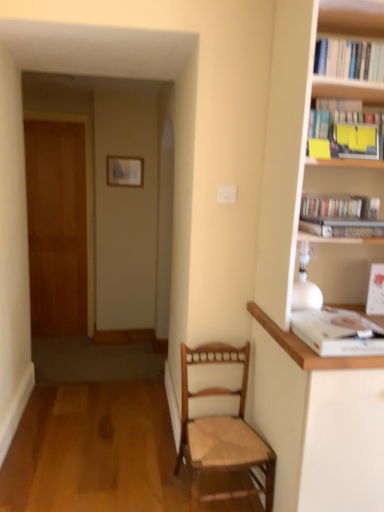
Question: Considering the relative positions of yellow paper at upper right, acting as the 2th book starting from the top, and white paper book at upper right, the fifth book positioned from the top, in the image provided, is yellow paper at upper right, acting as the 2th book starting from the top, to the right of white paper book at upper right, the fifth book positioned from the top, from the viewer's perspective?

Choices:
 (A) yes
 (B) no

Answer: (A)

Question: From the image's perspective, is yellow paper at upper right, acting as the 2th book starting from the top, over white paper book at upper right, which is counted as the first book, starting from the bottom?

Choices:
 (A) yes
 (B) no

Answer: (A)

Question: Is yellow paper at upper right, which appears as the fourth book when ordered from the bottom, wider than white paper book at upper right, which is counted as the first book, starting from the bottom?

Choices:
 (A) no
 (B) yes

Answer: (A)

Question: Considering the relative positions of yellow paper at upper right, which appears as the fourth book when ordered from the bottom, and white paper book at upper right, which is counted as the first book, starting from the bottom, in the image provided, is yellow paper at upper right, which appears as the fourth book when ordered from the bottom, to the left of white paper book at upper right, which is counted as the first book, starting from the bottom, from the viewer's perspective?

Choices:
 (A) yes
 (B) no

Answer: (B)

Question: Is yellow paper at upper right, which appears as the fourth book when ordered from the bottom, not close to white paper book at upper right, which is counted as the first book, starting from the bottom?

Choices:
 (A) no
 (B) yes

Answer: (A)

Question: Do you think wooden picture frame at upper center is within hardcover book at upper right, the 2th book in the bottom-to-top sequence, or outside of it?

Choices:
 (A) inside
 (B) outside

Answer: (B)

Question: From a real-world perspective, is wooden picture frame at upper center physically located above or below hardcover book at upper right, marked as the 4th book in a top-to-bottom arrangement?

Choices:
 (A) below
 (B) above

Answer: (B)

Question: Would you say wooden picture frame at upper center is to the left or to the right of hardcover book at upper right, marked as the 4th book in a top-to-bottom arrangement, in the picture?

Choices:
 (A) left
 (B) right

Answer: (A)

Question: In terms of width, does wooden picture frame at upper center look wider or thinner when compared to hardcover book at upper right, the 2th book in the bottom-to-top sequence?

Choices:
 (A) thin
 (B) wide

Answer: (A)

Question: Visually, is wooden door at left positioned to the left or to the right of white paperbacks at upper right, the 5th book ordered from the bottom?

Choices:
 (A) right
 (B) left

Answer: (B)

Question: Is wooden door at left wider or thinner than white paperbacks at upper right, arranged as the first book when viewed from the top?

Choices:
 (A) wide
 (B) thin

Answer: (B)

Question: Do you think wooden door at left is within white paperbacks at upper right, arranged as the first book when viewed from the top, or outside of it?

Choices:
 (A) outside
 (B) inside

Answer: (A)

Question: Considering the positions of wooden door at left and white paperbacks at upper right, the 5th book ordered from the bottom, in the image, is wooden door at left bigger or smaller than white paperbacks at upper right, the 5th book ordered from the bottom,?

Choices:
 (A) small
 (B) big

Answer: (B)

Question: Is wooden desk at right to the left or to the right of hardcover book at upper right, the 2th book in the bottom-to-top sequence, in the image?

Choices:
 (A) left
 (B) right

Answer: (B)

Question: Considering their positions, is wooden desk at right located in front of or behind hardcover book at upper right, the 2th book in the bottom-to-top sequence?

Choices:
 (A) front
 (B) behind

Answer: (A)